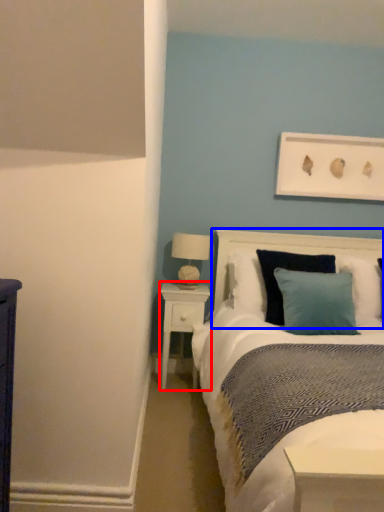
Question: Which of the following is the farthest to the observer, nightstand (highlighted by a red box) or headboard (highlighted by a blue box)?

Choices:
 (A) nightstand
 (B) headboard

Answer: (A)